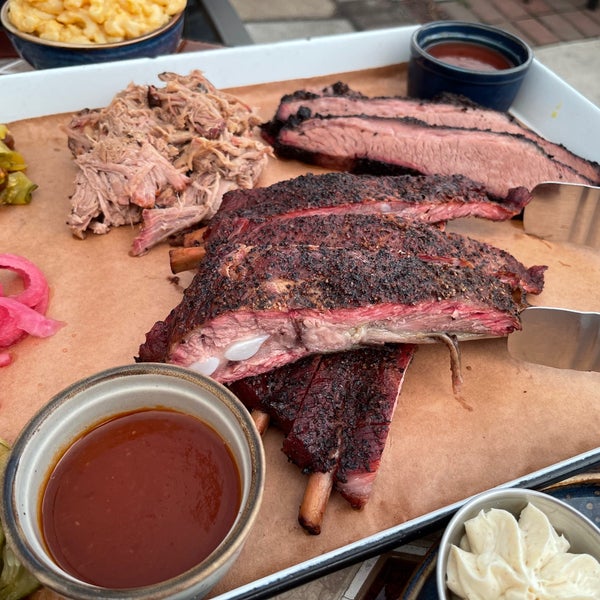
The image size is (600, 600). Identify the location of plate. (115, 305).